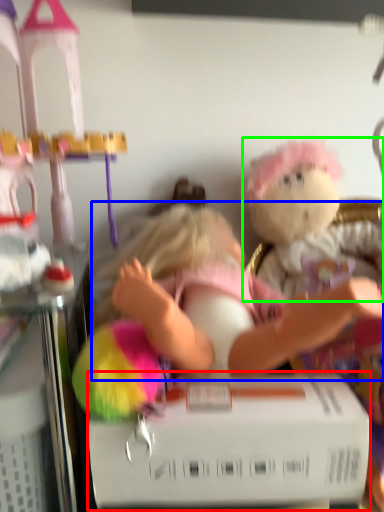
Question: Which object is the farthest from box (highlighted by a red box)? Choose among these: person (highlighted by a blue box) or toy (highlighted by a green box).

Choices:
 (A) person
 (B) toy

Answer: (B)